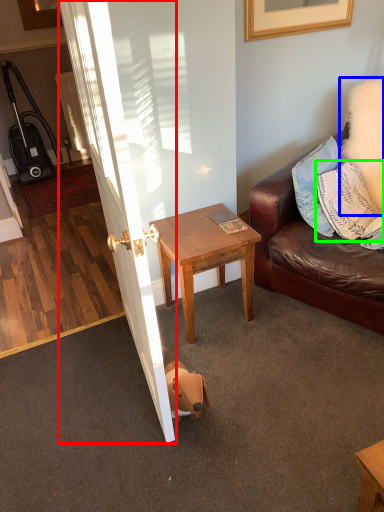
Question: Estimate the real-world distances between objects in this image. Which object is closer to door (highlighted by a red box), pillow (highlighted by a blue box) or pillow (highlighted by a green box)?

Choices:
 (A) pillow
 (B) pillow

Answer: (B)